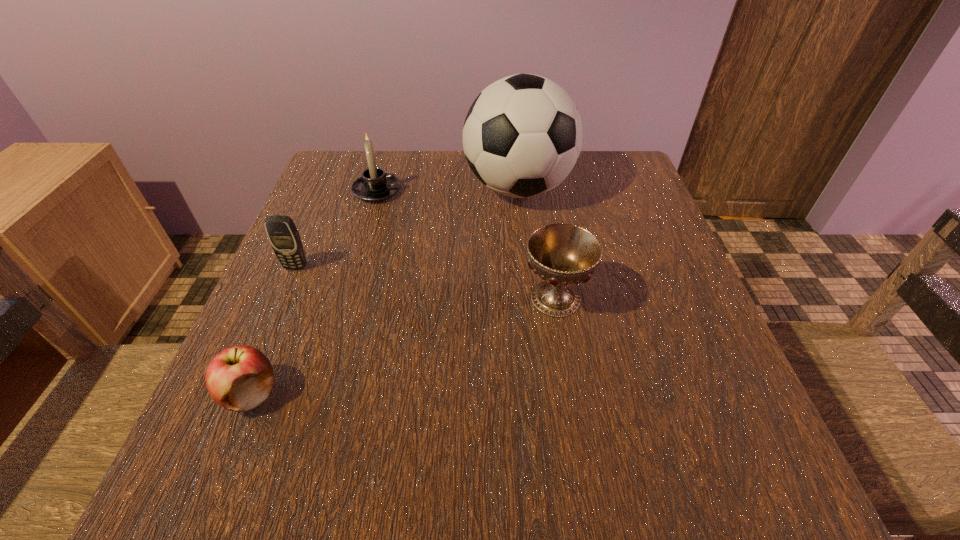
At what (x,y) coordinates should I click in order to perform the action: click on vacant space at the left edge of the desktop. Please return your answer as a coordinate pair (x, y). This screenshot has width=960, height=540. Looking at the image, I should click on (302, 218).

What are the coordinates of `vacant space at the right edge of the desktop` in the screenshot? It's located at (610, 270).

I want to click on vacant region at the far left corner, so click(344, 197).

Locate an element on the screen. blank space at the far right corner is located at coordinates (643, 190).

In the image, there is a desktop. Identify the location of vacant space at the near right corner. The height and width of the screenshot is (540, 960). (747, 504).

You are a GUI agent. You are given a task and a screenshot of the screen. Output one action in this format:
    pyautogui.click(x=<x>, y=<y>)
    Task: Click on the free space between the second tallest object and the shortest object
    
    Given the screenshot: What is the action you would take?
    pyautogui.click(x=314, y=292)

Where is `free spot between the cellular telephone and the nearest object`? Image resolution: width=960 pixels, height=540 pixels. free spot between the cellular telephone and the nearest object is located at coordinates (274, 330).

The height and width of the screenshot is (540, 960). Identify the location of vacant region between the apple and the fourth shortest object. (314, 292).

Identify the location of free space between the third farthest object and the fourth farthest object. This screenshot has height=540, width=960. (426, 282).

The image size is (960, 540). Find the location of `free space between the chalice and the apple`. free space between the chalice and the apple is located at coordinates (403, 346).